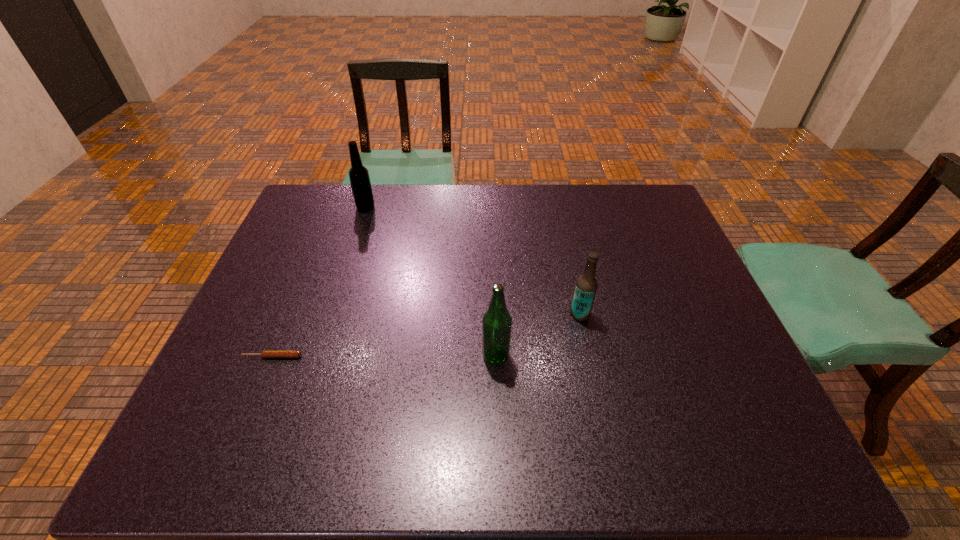
This screenshot has height=540, width=960. In the image, there is a desktop. Identify the location of free space at the left edge. (323, 242).

Identify the location of vacant area at the right edge. (724, 411).

In the image, there is a desktop. Where is `vacant space at the far right corner`? This screenshot has height=540, width=960. vacant space at the far right corner is located at coordinates click(x=659, y=198).

At what (x,y) coordinates should I click in order to perform the action: click on vacant space that's between the second beer bottle from left to right and the leftmost object. Please return your answer as a coordinate pair (x, y). This screenshot has height=540, width=960. Looking at the image, I should click on (384, 356).

Locate an element on the screen. The width and height of the screenshot is (960, 540). vacant space that is in between the third object from right to left and the second beer bottle from left to right is located at coordinates (431, 282).

Find the location of a particular element. This screenshot has height=540, width=960. free space between the third object from right to left and the rightmost object is located at coordinates (473, 261).

Where is `vacant area between the farthest beer bottle and the rightmost beer bottle`? vacant area between the farthest beer bottle and the rightmost beer bottle is located at coordinates (473, 261).

At what (x,y) coordinates should I click in order to perform the action: click on free spot between the sausage and the rightmost object. Please return your answer as a coordinate pair (x, y). The height and width of the screenshot is (540, 960). Looking at the image, I should click on (426, 335).

Identify the location of empty space between the third object from left to right and the rightmost beer bottle. This screenshot has height=540, width=960. (538, 335).

The height and width of the screenshot is (540, 960). What are the coordinates of `free area in between the second farthest object and the second object from right to left` in the screenshot? It's located at (x=538, y=335).